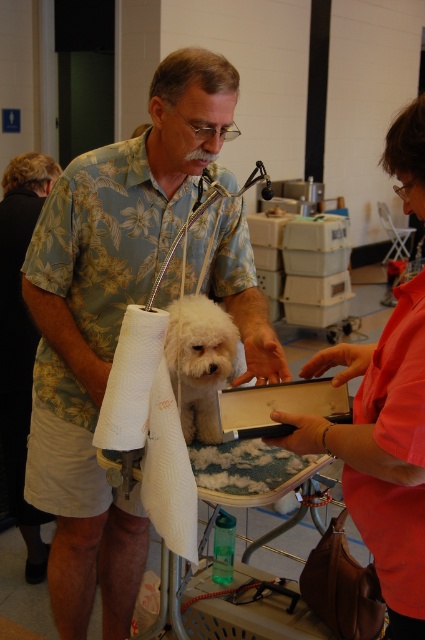
How much distance is there between black fabric hair at upper left and white paper towel at left?

3.87 feet

Is point (10, 173) less distant than point (119, 401)?

That is False.

Find the location of a particular element. This screenshot has width=425, height=640. black fabric hair at upper left is located at coordinates (19, 340).

Does floral shirt at center have a greater height compared to matte pink shirt at center?

Correct, floral shirt at center is much taller as matte pink shirt at center.

Can you confirm if floral shirt at center is positioned below matte pink shirt at center?

Indeed, floral shirt at center is positioned under matte pink shirt at center.

Identify the location of floral shirt at center. Image resolution: width=425 pixels, height=640 pixels. (108, 323).

Does matte pink shirt at center have a smaller size compared to white paper towel at left?

No, matte pink shirt at center is not smaller than white paper towel at left.

Who is taller, matte pink shirt at center or white paper towel at left?

Standing taller between the two is matte pink shirt at center.

Is point (345, 458) more distant than point (144, 340)?

No, it is in front of (144, 340).

I want to click on matte pink shirt at center, so click(382, 451).